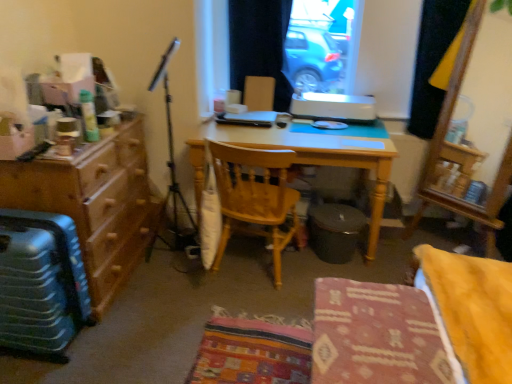
Measure the distance between black fabric curtain at upper right, which is counted as the 1th curtain, starting from the right, and camera.

8.11 feet.

What is the approximate height of black fabric curtain at upper right, which is counted as the 1th curtain, starting from the right?

black fabric curtain at upper right, which is counted as the 1th curtain, starting from the right, is 86.01 centimeters tall.

Describe the element at coordinates (417, 325) in the screenshot. The width and height of the screenshot is (512, 384). I see `patterned fabric chair at center, arranged as the 1th chair when viewed from the front` at that location.

Identify the location of light wood desk at center. The width and height of the screenshot is (512, 384). (307, 158).

The height and width of the screenshot is (384, 512). Find the location of `metallic suitcase at lower left`. metallic suitcase at lower left is located at coordinates (41, 284).

Where is `wooden chair at center, which is the 1th chair from back to front`? wooden chair at center, which is the 1th chair from back to front is located at coordinates (256, 198).

The image size is (512, 384). Find the location of `wooden chair at center`. wooden chair at center is located at coordinates (259, 93).

From a real-world perspective, between black fabric curtain at upper center, the second curtain positioned from the right, and wooden chair at center, marked as the 2th chair in a front-to-back arrangement, who is vertically higher?

In real-world perspective, black fabric curtain at upper center, the second curtain positioned from the right, is above.

How much distance is there between black fabric curtain at upper center, which is the first curtain in left-to-right order, and wooden chair at center, which is the 1th chair from back to front?

Result: black fabric curtain at upper center, which is the first curtain in left-to-right order, is 34.17 inches from wooden chair at center, which is the 1th chair from back to front.

Does point (232, 2) come closer to viewer compared to point (286, 217)?

No, it is not.

Which object is further away from the camera, black fabric curtain at upper center, which is the first curtain in left-to-right order, or wooden chair at center, which is the 1th chair from back to front?

black fabric curtain at upper center, which is the first curtain in left-to-right order, is behind.

The height and width of the screenshot is (384, 512). Identify the location of the 1st chair in front of the black fabric curtain at upper center, which is the first curtain in left-to-right order. (256, 198).

From the image's perspective, is wooden chair at center, which is the 1th chair from back to front, located above black fabric curtain at upper center, which is the first curtain in left-to-right order?

Actually, wooden chair at center, which is the 1th chair from back to front, appears below black fabric curtain at upper center, which is the first curtain in left-to-right order, in the image.

Consider the image. Between wooden chair at center, which is the 1th chair from back to front, and black fabric curtain at upper center, the second curtain positioned from the right, which one has smaller width?

black fabric curtain at upper center, the second curtain positioned from the right.

Is point (222, 255) in front of point (262, 52)?

Yes, point (222, 255) is in front of point (262, 52).

Between patterned fabric chair at center, marked as the 2th chair in a back-to-front arrangement, and black fabric curtain at upper right, which is counted as the 1th curtain, starting from the right, which one appears on the left side from the viewer's perspective?

From the viewer's perspective, patterned fabric chair at center, marked as the 2th chair in a back-to-front arrangement, appears more on the left side.

Can you confirm if patterned fabric chair at center, arranged as the 1th chair when viewed from the front, is shorter than black fabric curtain at upper right, which is counted as the 1th curtain, starting from the right?

Yes, patterned fabric chair at center, arranged as the 1th chair when viewed from the front, is shorter than black fabric curtain at upper right, which is counted as the 1th curtain, starting from the right.

Is patterned fabric chair at center, marked as the 2th chair in a back-to-front arrangement, beside black fabric curtain at upper right, which is counted as the 1th curtain, starting from the right?

No, patterned fabric chair at center, marked as the 2th chair in a back-to-front arrangement, is not in contact with black fabric curtain at upper right, which is counted as the 1th curtain, starting from the right.

Which is behind, metallic suitcase at lower left or wooden chair at center, marked as the 2th chair in a front-to-back arrangement?

wooden chair at center, marked as the 2th chair in a front-to-back arrangement, is further away from the camera.

Considering the points (59, 310) and (274, 159), which point is behind, point (59, 310) or point (274, 159)?

The point (274, 159) is more distant.

Who is shorter, metallic suitcase at lower left or wooden chair at center, which is the 1th chair from back to front?

metallic suitcase at lower left.

Can you tell me how much metallic suitcase at lower left and wooden chair at center, which is the 1th chair from back to front, differ in facing direction?

The facing directions of metallic suitcase at lower left and wooden chair at center, which is the 1th chair from back to front, are 79.5 degrees apart.

Is point (282, 97) farther from viewer compared to point (142, 249)?

That is True.

Where is `cabinetry beneath the black fabric curtain at upper center, which is the first curtain in left-to-right order (from a real-world perspective)`? The image size is (512, 384). cabinetry beneath the black fabric curtain at upper center, which is the first curtain in left-to-right order (from a real-world perspective) is located at coordinates (94, 204).

Considering the positions of objects black fabric curtain at upper center, the second curtain positioned from the right, and brown wood dresser at left in the image provided, who is behind, black fabric curtain at upper center, the second curtain positioned from the right, or brown wood dresser at left?

black fabric curtain at upper center, the second curtain positioned from the right, is further away from the camera.

Considering the sizes of objects black fabric curtain at upper center, which is the first curtain in left-to-right order, and brown wood dresser at left in the image provided, who is wider, black fabric curtain at upper center, which is the first curtain in left-to-right order, or brown wood dresser at left?

Wider between the two is brown wood dresser at left.

From the image's perspective, is wooden chair at center positioned above or below metallic suitcase at lower left?

Clearly, from the image's perspective, wooden chair at center is above metallic suitcase at lower left.

From a real-world perspective, is wooden chair at center positioned above or below metallic suitcase at lower left?

wooden chair at center is above metallic suitcase at lower left.

What are the coordinates of `luggage that appears in front of the wooden chair at center` in the screenshot? It's located at (41, 284).

From a real-world perspective, relative to brown wood dresser at left, is patterned fabric chair at center, marked as the 2th chair in a back-to-front arrangement, vertically above or below?

Clearly, from a real-world perspective, patterned fabric chair at center, marked as the 2th chair in a back-to-front arrangement, is below brown wood dresser at left.

Is patterned fabric chair at center, arranged as the 1th chair when viewed from the front, wider than brown wood dresser at left?

In fact, patterned fabric chair at center, arranged as the 1th chair when viewed from the front, might be narrower than brown wood dresser at left.

Would you say patterned fabric chair at center, marked as the 2th chair in a back-to-front arrangement, contains brown wood dresser at left?

That's incorrect, brown wood dresser at left is not inside patterned fabric chair at center, marked as the 2th chair in a back-to-front arrangement.

Could you measure the distance between patterned fabric chair at center, marked as the 2th chair in a back-to-front arrangement, and brown wood dresser at left?

patterned fabric chair at center, marked as the 2th chair in a back-to-front arrangement, is 1.38 meters away from brown wood dresser at left.

Image resolution: width=512 pixels, height=384 pixels. I want to click on the 1st curtain to the right when counting from the wooden chair at center, which is the 1th chair from back to front, so click(260, 45).

Identify the location of curtain that is the 2nd object located behind the wooden chair at center, which is the 1th chair from back to front. (260, 45).

When comparing their distances from brown wood dresser at left, does wooden chair at center, marked as the 2th chair in a front-to-back arrangement, or patterned fabric chair at center, arranged as the 1th chair when viewed from the front, seem further?

Among the two, patterned fabric chair at center, arranged as the 1th chair when viewed from the front, is located further to brown wood dresser at left.

Considering their positions, is metallic suitcase at lower left positioned further to wooden chair at center, marked as the 2th chair in a front-to-back arrangement, than patterned fabric chair at center, marked as the 2th chair in a back-to-front arrangement?

metallic suitcase at lower left lies further to wooden chair at center, marked as the 2th chair in a front-to-back arrangement, than the other object.

Looking at this image, estimate the real-world distances between objects in this image. Which object is further from black fabric curtain at upper right, which is counted as the 1th curtain, starting from the right, patterned fabric chair at center, marked as the 2th chair in a back-to-front arrangement, or light wood desk at center?

The object further to black fabric curtain at upper right, which is counted as the 1th curtain, starting from the right, is patterned fabric chair at center, marked as the 2th chair in a back-to-front arrangement.

From the image, which object appears to be nearer to wooden chair at center, black fabric curtain at upper center, the second curtain positioned from the right, or black fabric curtain at upper right, which is counted as the 1th curtain, starting from the right?

Based on the image, black fabric curtain at upper center, the second curtain positioned from the right, appears to be nearer to wooden chair at center.

Based on their spatial positions, is black fabric curtain at upper center, the second curtain positioned from the right, or patterned fabric chair at center, arranged as the 1th chair when viewed from the front, further from wooden chair at center?

patterned fabric chair at center, arranged as the 1th chair when viewed from the front.

Consider the image. Considering their positions, is light wood desk at center positioned closer to patterned fabric chair at center, marked as the 2th chair in a back-to-front arrangement, than black fabric curtain at upper right, which is counted as the 1th curtain, starting from the right?

The object closer to patterned fabric chair at center, marked as the 2th chair in a back-to-front arrangement, is light wood desk at center.

When comparing their distances from black fabric curtain at upper right, which is counted as the 1th curtain, starting from the right, does wooden chair at center or brown wood dresser at left seem closer?

wooden chair at center lies closer to black fabric curtain at upper right, which is counted as the 1th curtain, starting from the right, than the other object.

Estimate the real-world distances between objects in this image. Which object is further from black fabric curtain at upper right, acting as the second curtain starting from the left, patterned fabric chair at center, marked as the 2th chair in a back-to-front arrangement, or wooden chair at center?

patterned fabric chair at center, marked as the 2th chair in a back-to-front arrangement.

Locate an element on the screen. The width and height of the screenshot is (512, 384). desk between wooden chair at center and black fabric curtain at upper right, which is counted as the 1th curtain, starting from the right is located at coordinates (307, 158).

This screenshot has width=512, height=384. Identify the location of desk between brown wood dresser at left and patterned fabric chair at center, marked as the 2th chair in a back-to-front arrangement, from left to right. (307, 158).

Locate an element on the screen. armchair between wooden chair at center, which is the 1th chair from back to front, and black fabric curtain at upper right, acting as the second curtain starting from the left is located at coordinates (259, 93).

I want to click on armchair that lies between black fabric curtain at upper center, the second curtain positioned from the right, and metallic suitcase at lower left from top to bottom, so click(x=259, y=93).